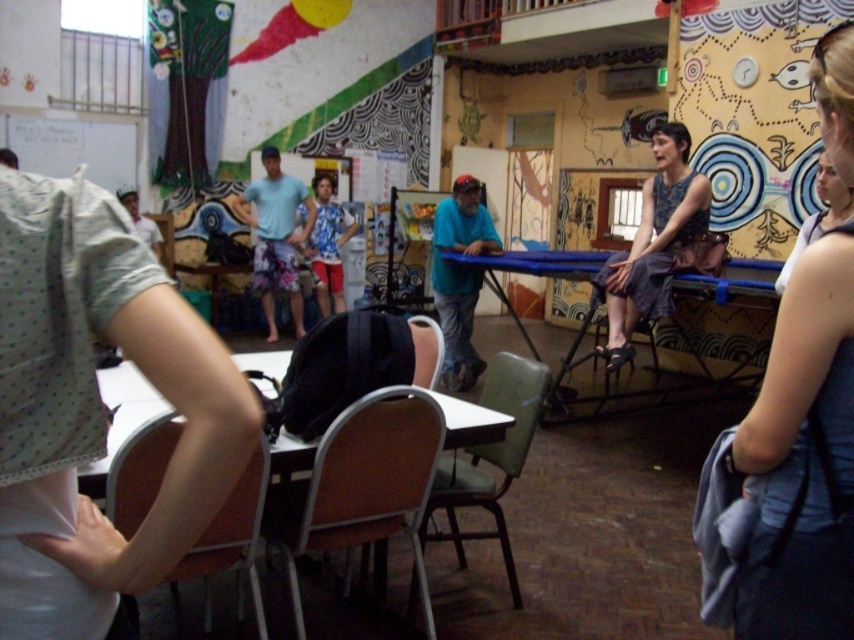
You are standing at the entrance of the community center and want to greet both the person wearing the blue denim tank top at upper right and the person wearing the teal fabric shirt at center. If you walk straight ahead, which person will you reach first?

The teal fabric shirt at center will be reached first because it is closer to you than the blue denim tank top at upper right, which is 4.36 meters away from it.